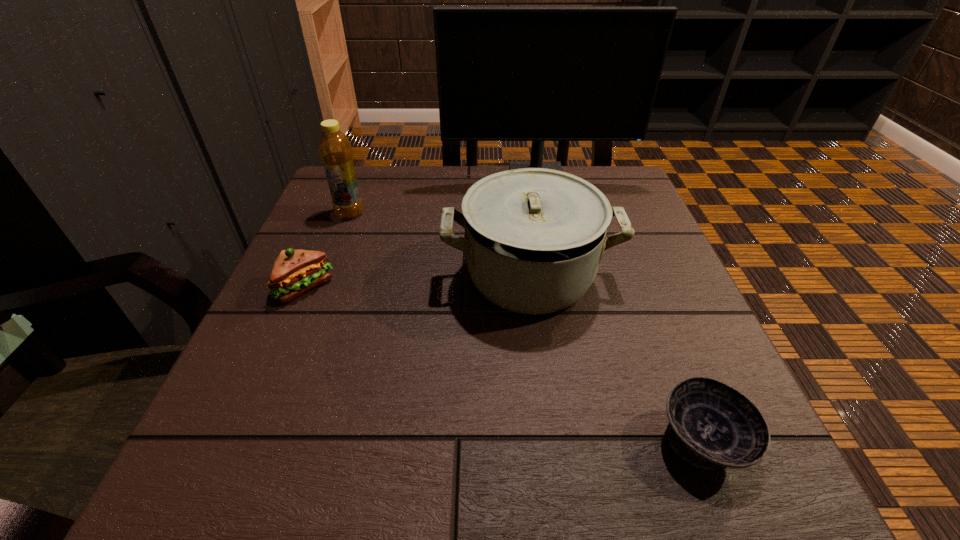
What are the coordinates of `free space that satisfies the following two spatial constraints: 1. on the front-facing side of the shortest object; 2. on the right side of the computer monitor` in the screenshot? It's located at (587, 441).

Identify the location of vacant point that satisfies the following two spatial constraints: 1. on the front side of the second shortest object; 2. on the left side of the shortest object. (239, 441).